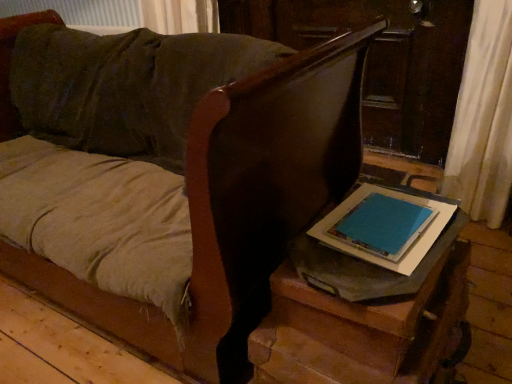
Question: From the image's perspective, does blue matte tablet at center appear higher than matte gray table at lower right?

Choices:
 (A) no
 (B) yes

Answer: (B)

Question: Is blue matte tablet at center not near matte gray table at lower right?

Choices:
 (A) yes
 (B) no

Answer: (B)

Question: Is the depth of blue matte tablet at center less than that of matte gray table at lower right?

Choices:
 (A) yes
 (B) no

Answer: (B)

Question: Is blue matte tablet at center looking in the opposite direction of matte gray table at lower right?

Choices:
 (A) yes
 (B) no

Answer: (A)

Question: Are blue matte tablet at center and matte gray table at lower right making contact?

Choices:
 (A) no
 (B) yes

Answer: (A)

Question: Does blue matte tablet at center come behind matte gray table at lower right?

Choices:
 (A) no
 (B) yes

Answer: (B)

Question: Considering the relative sizes of wooden side table at lower right and matte gray table at lower right in the image provided, is wooden side table at lower right shorter than matte gray table at lower right?

Choices:
 (A) yes
 (B) no

Answer: (B)

Question: From the image's perspective, is wooden side table at lower right on matte gray table at lower right?

Choices:
 (A) no
 (B) yes

Answer: (B)

Question: Can you confirm if wooden side table at lower right is positioned to the right of matte gray table at lower right?

Choices:
 (A) no
 (B) yes

Answer: (A)

Question: Considering the relative sizes of wooden side table at lower right and matte gray table at lower right in the image provided, is wooden side table at lower right bigger than matte gray table at lower right?

Choices:
 (A) yes
 (B) no

Answer: (A)

Question: Is wooden side table at lower right positioned in front of matte gray table at lower right?

Choices:
 (A) no
 (B) yes

Answer: (B)

Question: Is wooden side table at lower right outside matte gray table at lower right?

Choices:
 (A) no
 (B) yes

Answer: (B)

Question: From a real-world perspective, is wooden side table at lower right over blue matte tablet at center?

Choices:
 (A) no
 (B) yes

Answer: (A)